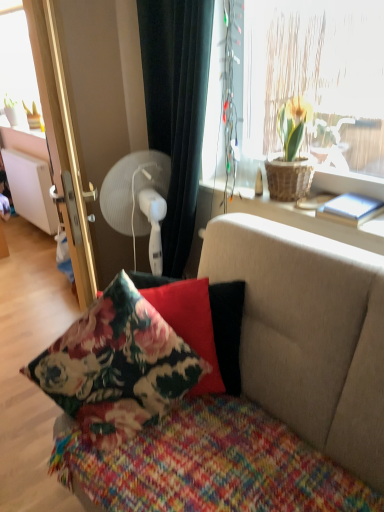
Question: From a real-world perspective, is white plastic fan at upper left physically located above or below floral fabric pillow at center, placed as the second pillow when sorted from front to back?

Choices:
 (A) below
 (B) above

Answer: (B)

Question: In the image, is white plastic fan at upper left on the left side or the right side of floral fabric pillow at center, placed as the second pillow when sorted from front to back?

Choices:
 (A) right
 (B) left

Answer: (B)

Question: Estimate the real-world distances between objects in this image. Which object is farther from the metallic gold screen door at left?

Choices:
 (A) brown woven basket at upper right
 (B) white matte radiator at left
 (C) woven wicker basket at upper right
 (D) floral fabric couch at center
 (E) white plastic fan at upper left

Answer: (B)

Question: Which object is positioned farthest from the white plastic fan at upper left?

Choices:
 (A) metallic gold screen door at left
 (B) black fabric curtain at upper center
 (C) floral fabric pillow at center, the 1th pillow from the back
 (D) brown woven basket at upper right
 (E) knitted multicolored blanket at center

Answer: (E)